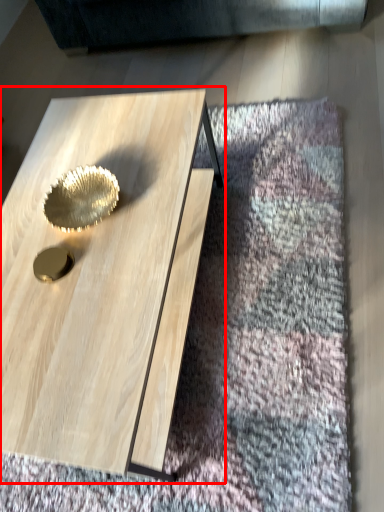
Question: From the image's perspective, where is coffee table (annotated by the red box) located relative to gold?

Choices:
 (A) below
 (B) above

Answer: (A)